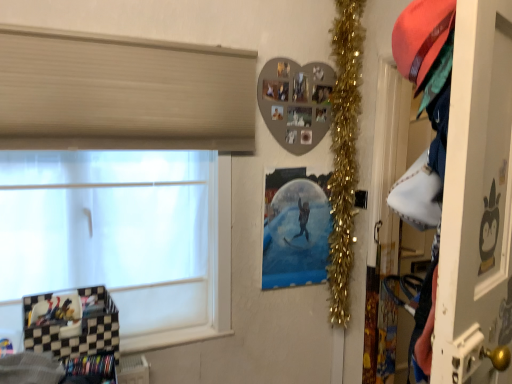
Question: Is metallic silver poster at center to the left or to the right of white glossy screen door at right in the image?

Choices:
 (A) left
 (B) right

Answer: (A)

Question: Based on their sizes in the image, would you say metallic silver poster at center is bigger or smaller than white glossy screen door at right?

Choices:
 (A) small
 (B) big

Answer: (A)

Question: Which object is positioned farthest from the gold tinsel garland at upper right?

Choices:
 (A) white matte window at left
 (B) white glossy screen door at right
 (C) metallic silver poster at center

Answer: (B)

Question: Estimate the real-world distances between objects in this image. Which object is farther from the white matte window at left?

Choices:
 (A) white glossy screen door at right
 (B) gold tinsel garland at upper right
 (C) metallic silver poster at center

Answer: (A)